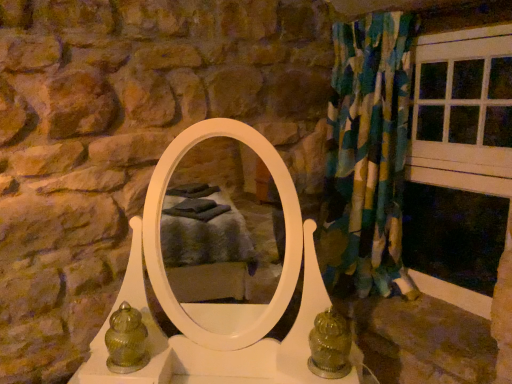
Question: From the image's perspective, is green glass vase at lower left on textured fabric curtain at right?

Choices:
 (A) no
 (B) yes

Answer: (A)

Question: Would you consider green glass vase at lower left to be distant from textured fabric curtain at right?

Choices:
 (A) no
 (B) yes

Answer: (A)

Question: Does green glass vase at lower left appear on the left side of textured fabric curtain at right?

Choices:
 (A) no
 (B) yes

Answer: (B)

Question: Is green glass vase at lower left oriented towards textured fabric curtain at right?

Choices:
 (A) no
 (B) yes

Answer: (A)

Question: From a real-world perspective, is green glass vase at lower left positioned over textured fabric curtain at right based on gravity?

Choices:
 (A) yes
 (B) no

Answer: (B)

Question: Is textured fabric curtain at right wider or thinner than green glass vase at lower left?

Choices:
 (A) wide
 (B) thin

Answer: (A)

Question: Is point (340, 142) positioned closer to the camera than point (130, 347)?

Choices:
 (A) closer
 (B) farther

Answer: (B)

Question: Is textured fabric curtain at right in front of or behind green glass vase at lower left in the image?

Choices:
 (A) front
 (B) behind

Answer: (B)

Question: Based on their positions, is textured fabric curtain at right located to the left or right of green glass vase at lower left?

Choices:
 (A) right
 (B) left

Answer: (A)

Question: Looking at the image, does green glass vase at lower left seem bigger or smaller compared to white wood window frame at right?

Choices:
 (A) big
 (B) small

Answer: (B)

Question: Is green glass vase at lower left in front of or behind white wood window frame at right in the image?

Choices:
 (A) behind
 (B) front

Answer: (B)

Question: From the image's perspective, relative to white wood window frame at right, is green glass vase at lower left above or below?

Choices:
 (A) below
 (B) above

Answer: (A)

Question: Is green glass vase at lower left inside or outside of white wood window frame at right?

Choices:
 (A) outside
 (B) inside

Answer: (A)

Question: Is green glass vase at lower left spatially inside textured fabric curtain at right, or outside of it?

Choices:
 (A) outside
 (B) inside

Answer: (A)

Question: Based on their positions, is green glass vase at lower left located to the left or right of textured fabric curtain at right?

Choices:
 (A) right
 (B) left

Answer: (B)